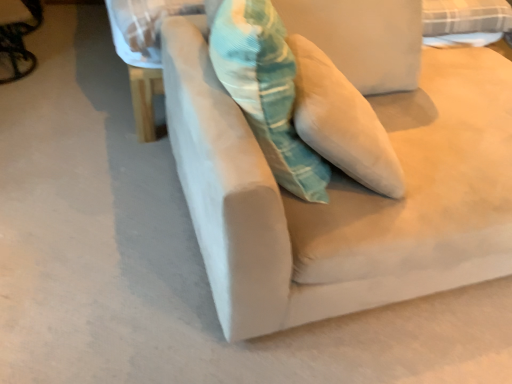
Question: Is textured teal pillow at center aimed at suede beige couch at center?

Choices:
 (A) no
 (B) yes

Answer: (B)

Question: Is textured teal pillow at center at the left side of suede beige couch at center?

Choices:
 (A) no
 (B) yes

Answer: (B)

Question: Considering the relative sizes of textured teal pillow at center and suede beige couch at center in the image provided, is textured teal pillow at center wider than suede beige couch at center?

Choices:
 (A) yes
 (B) no

Answer: (B)

Question: Can you confirm if textured teal pillow at center is shorter than suede beige couch at center?

Choices:
 (A) no
 (B) yes

Answer: (B)

Question: Is textured teal pillow at center in contact with suede beige couch at center?

Choices:
 (A) yes
 (B) no

Answer: (B)

Question: Is suede beige couch at center inside textured teal pillow at center?

Choices:
 (A) yes
 (B) no

Answer: (B)

Question: From a real-world perspective, is suede beige couch at center over textured teal pillow at center?

Choices:
 (A) no
 (B) yes

Answer: (A)

Question: Does suede beige couch at center appear on the right side of textured teal pillow at center?

Choices:
 (A) yes
 (B) no

Answer: (A)

Question: Considering the relative sizes of suede beige couch at center and textured teal pillow at center in the image provided, is suede beige couch at center wider than textured teal pillow at center?

Choices:
 (A) no
 (B) yes

Answer: (B)

Question: Is suede beige couch at center looking in the opposite direction of textured teal pillow at center?

Choices:
 (A) yes
 (B) no

Answer: (B)

Question: Is suede beige couch at center positioned far away from textured teal pillow at center?

Choices:
 (A) no
 (B) yes

Answer: (A)

Question: Are suede beige couch at center and textured teal pillow at center making contact?

Choices:
 (A) yes
 (B) no

Answer: (B)

Question: From the image's perspective, does textured teal pillow at center appear lower than metallic silver swivel chair at left?

Choices:
 (A) yes
 (B) no

Answer: (A)